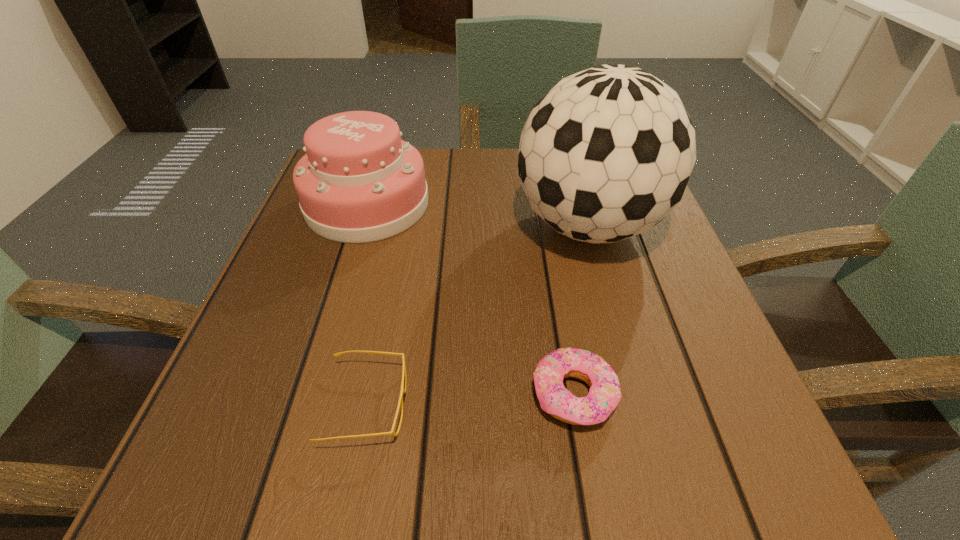
Where is `free space at the right edge of the desktop`? Image resolution: width=960 pixels, height=540 pixels. free space at the right edge of the desktop is located at coordinates (653, 391).

You are a GUI agent. You are given a task and a screenshot of the screen. Output one action in this format:
    pyautogui.click(x=<x>, y=<y>)
    Task: Click on the free region at the near left corner
    The width and height of the screenshot is (960, 540).
    Given the screenshot: What is the action you would take?
    pyautogui.click(x=204, y=467)

Find the location of a particular element. The width and height of the screenshot is (960, 540). free space between the third shortest object and the doughnut is located at coordinates (470, 300).

This screenshot has height=540, width=960. What are the coordinates of `empty location between the doughnut and the tallest object` in the screenshot? It's located at (581, 310).

You are a GUI agent. You are given a task and a screenshot of the screen. Output one action in this format:
    pyautogui.click(x=<x>, y=<y>)
    Task: Click on the free area in between the tallest object and the doughnut
    The height and width of the screenshot is (540, 960).
    Given the screenshot: What is the action you would take?
    pyautogui.click(x=581, y=310)

This screenshot has width=960, height=540. In order to click on empty space between the spectacles and the birthday cake in this screenshot , I will do `click(367, 304)`.

Where is `vacant area that lies between the doughnut and the spectacles`? vacant area that lies between the doughnut and the spectacles is located at coordinates (470, 400).

Identify the location of empty space that is in between the spectacles and the doughnut. (470, 400).

Identify the location of free space between the birthday cake and the soccer ball. (477, 215).

Where is `vacant area between the second tallest object and the tallest object`? vacant area between the second tallest object and the tallest object is located at coordinates (477, 215).